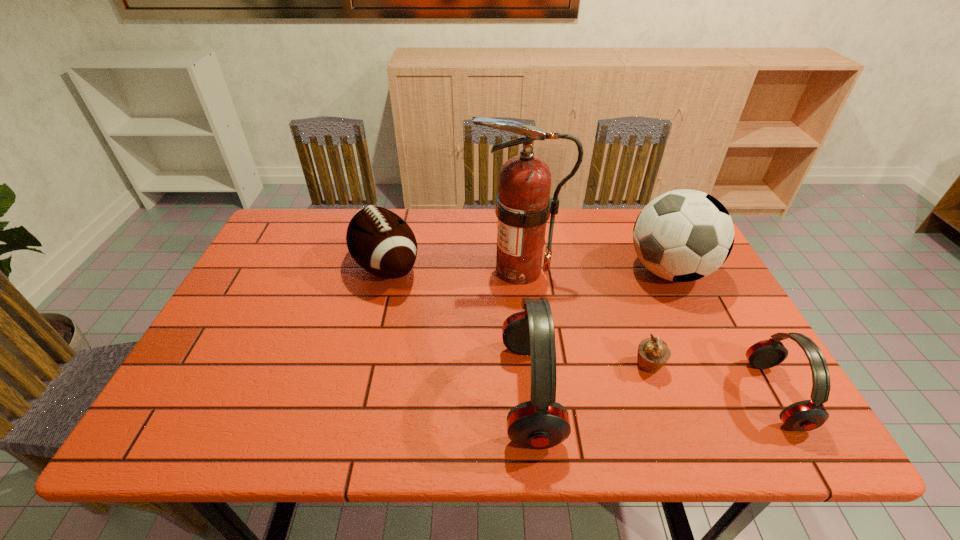
In the current image, all earphones are evenly spaced. To maintain this equal spacing, where should an additional earphone be placed on the left? Please point out a free spot. Please provide its 2D coordinates. Your answer should be formatted as a tuple, i.e. [(x, y)], where the tuple contains the x and y coordinates of a point satisfying the conditions above.

[(288, 390)]